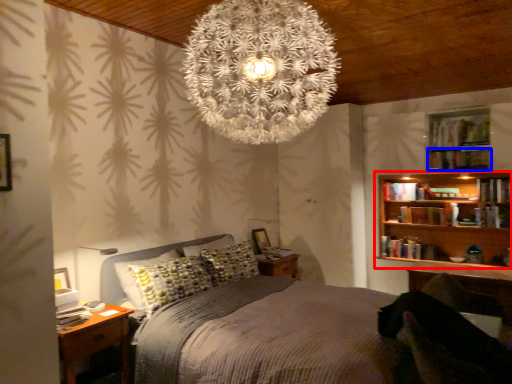
Question: Which point is further to the camera, bookcase (highlighted by a red box) or book (highlighted by a blue box)?

Choices:
 (A) bookcase
 (B) book

Answer: (A)